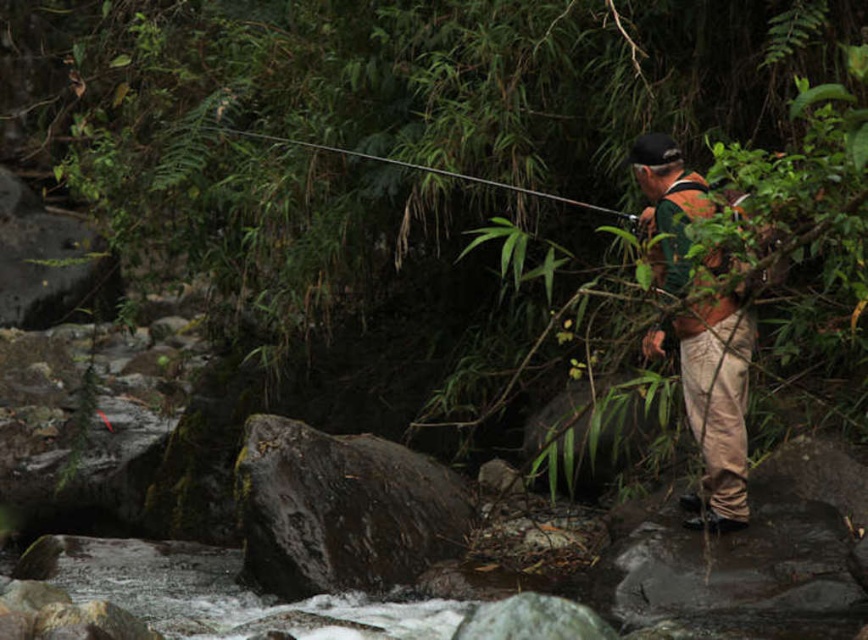
You are standing at the edge of the stream and see two points in the scene. The first point is located at coordinates point (285, 419) and the second point is at point (679, 154). Which point is closer to you?

Point (285, 419) is closer to you because it is further to the viewer than point (679, 154).

You are a fly fisherman standing on the dark brown rough rock at center. You want to cast your fishing line to the other side of the stream. The stream is 7.45 meters wide. If your fishing line is 8 meters long, can you reach the other side?

The stream is 7.45 meters wide, and your fishing line is 8 meters long. Since the line is longer than the stream width, you can cast it to the other side.

You are standing at the point with coordinates point (477, 177) and want to move towards the point with coordinates point (699, 520). Which direction should you move to get closer?

You should move forward because point (699, 520) is closer to the viewer than point (477, 177), meaning it is in front of you.